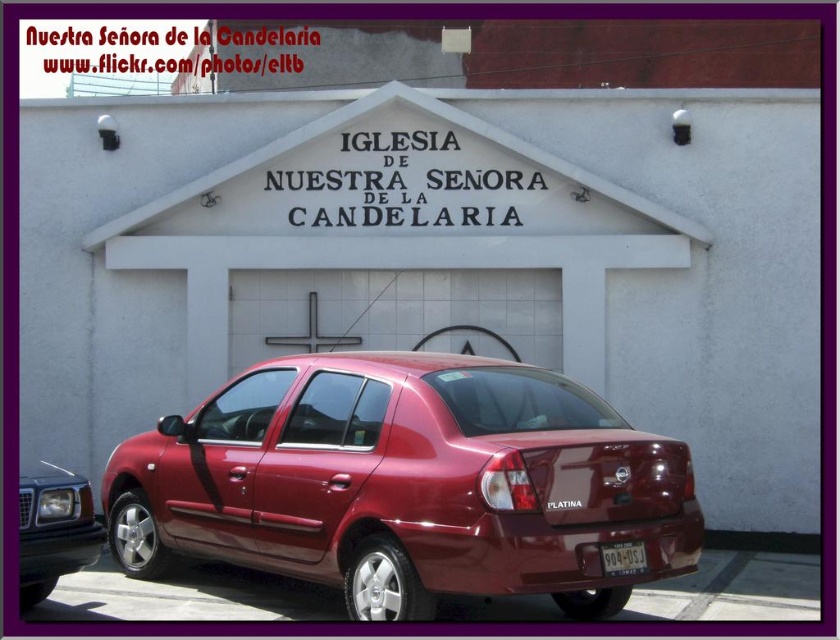
You are a delivery driver who needs to park your vehicle in front of the church. The parking area is narrow, and you must ensure your car fits without overlapping any existing vehicles or objects. Based on the scene, is there enough space to park your car next to the satin burgundy sedan at lower left and the yellowish matte license plate at center?

The satin burgundy sedan at lower left is larger in size than the yellowish matte license plate at center. Since the parking area is narrow and the existing sedan is already taking up more space, there might not be sufficient room for another vehicle without overlapping. It is advisable to look for an alternative parking spot.

You are a delivery person who needs to park your 1.8 meter tall delivery cart between the two satin burgundy sedan at lower center and satin burgundy sedan at lower left. Can you fit your cart between them without it touching either car?

The satin burgundy sedan at lower center is taller than the satin burgundy sedan at lower left. Since the height difference is not specified, but the cart is 1.8 meters tall, it is possible the cart may not fit if the space between them is constrained by their heights. However, since the question is about fitting between them without touching, the vertical height of the cars may not directly affect horizontal space. More information on the horizontal distance between the cars is needed to determine if the 1